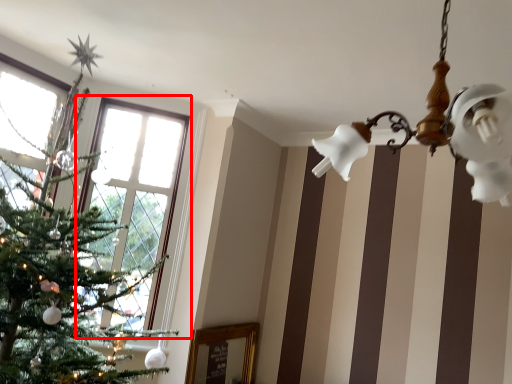
Question: From the image's perspective, where is window (annotated by the red box) located in relation to light fixture in the image?

Choices:
 (A) below
 (B) above

Answer: (A)